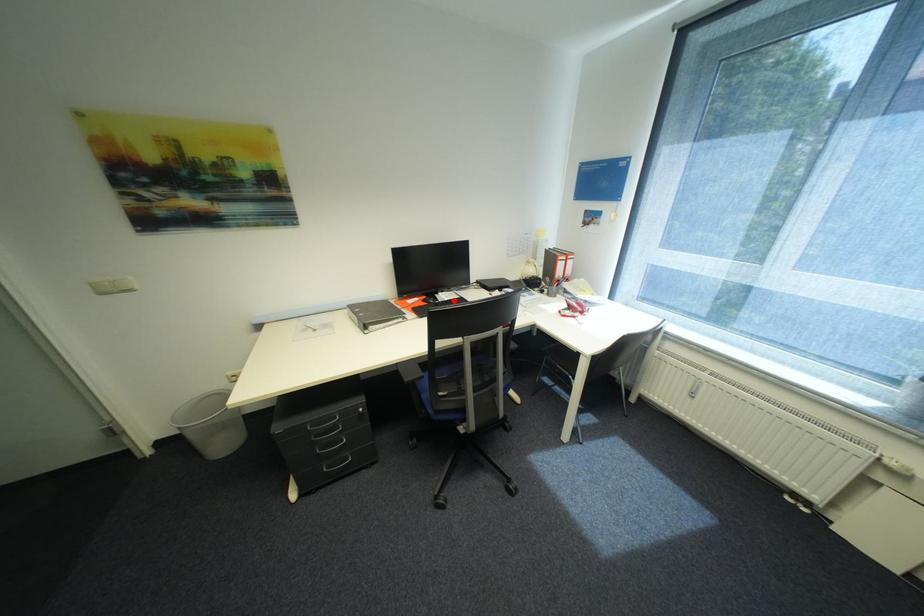
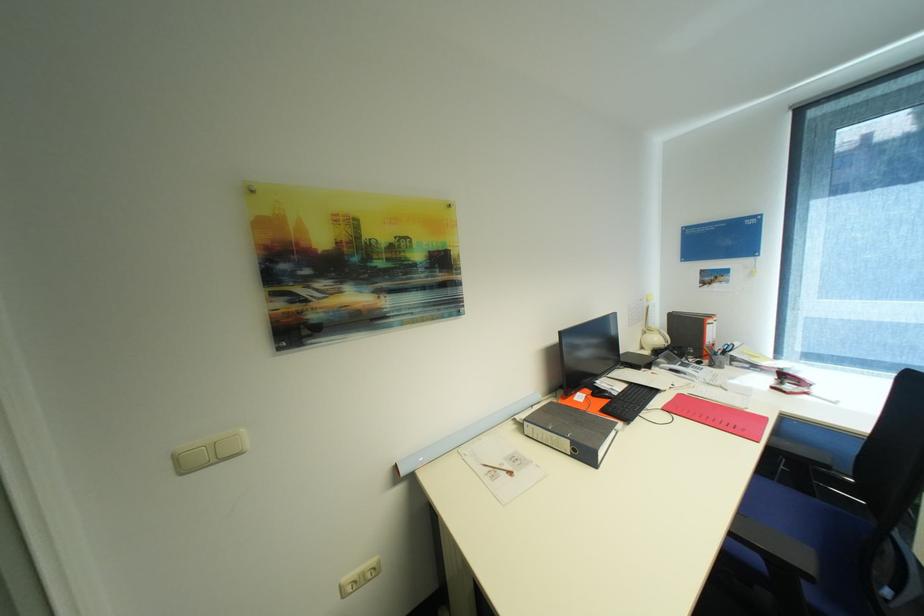
Locate, in the second image, the point that corresponds to the highlighted location in the first image.

(627, 391)